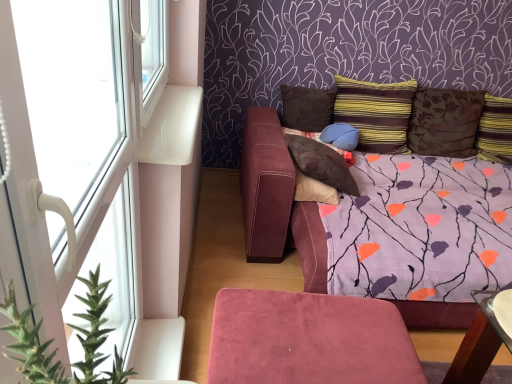
The height and width of the screenshot is (384, 512). In order to click on brown suede pillow at center, marked as the 1th pillow in a left-to-right arrangement in this screenshot , I will do `click(321, 163)`.

Locate an element on the screen. The width and height of the screenshot is (512, 384). brown suede pillow at upper center, the 2th pillow positioned from the left is located at coordinates (307, 107).

What do you see at coordinates (77, 172) in the screenshot? I see `white plastic window at left, acting as the 2th window starting from the top` at bounding box center [77, 172].

I want to click on brown suede pillow at center, which is the sixth pillow from right to left, so click(321, 163).

From the image's perspective, is white plastic window at left, which is the first window in bottom-to-top order, beneath striped fabric pillow at upper center, positioned as the fourth pillow in left-to-right order?

Indeed, from the image's perspective, white plastic window at left, which is the first window in bottom-to-top order, is shown beneath striped fabric pillow at upper center, positioned as the fourth pillow in left-to-right order.

Is white plastic window at left, which is the first window in bottom-to-top order, positioned with its back to striped fabric pillow at upper center, positioned as the fourth pillow in left-to-right order?

No, white plastic window at left, which is the first window in bottom-to-top order, is not facing the opposite direction of striped fabric pillow at upper center, positioned as the fourth pillow in left-to-right order.

Is the surface of white plastic window at left, which is the first window in bottom-to-top order, in direct contact with striped fabric pillow at upper center, placed as the 3th pillow when sorted from right to left?

No.

Does white plastic window at left, acting as the 2th window starting from the top, have a larger size compared to striped fabric pillow at upper center, positioned as the fourth pillow in left-to-right order?

Incorrect, white plastic window at left, acting as the 2th window starting from the top, is not larger than striped fabric pillow at upper center, positioned as the fourth pillow in left-to-right order.

Does brown textured pillow at upper right, arranged as the fifth pillow when viewed from the left, turn towards striped fabric pillow at upper right, marked as the 1th pillow in a right-to-left arrangement?

No, brown textured pillow at upper right, arranged as the fifth pillow when viewed from the left, is not aimed at striped fabric pillow at upper right, marked as the 1th pillow in a right-to-left arrangement.

Are brown textured pillow at upper right, which appears as the 2th pillow when viewed from the right, and striped fabric pillow at upper right, marked as the 1th pillow in a right-to-left arrangement, far apart?

No, brown textured pillow at upper right, which appears as the 2th pillow when viewed from the right, is in close proximity to striped fabric pillow at upper right, marked as the 1th pillow in a right-to-left arrangement.

Based on the photo, can you confirm if brown textured pillow at upper right, which appears as the 2th pillow when viewed from the right, is shorter than striped fabric pillow at upper right, marked as the 1th pillow in a right-to-left arrangement?

Incorrect, the height of brown textured pillow at upper right, which appears as the 2th pillow when viewed from the right, does not fall short of that of striped fabric pillow at upper right, marked as the 1th pillow in a right-to-left arrangement.

Does brown textured pillow at upper right, which appears as the 2th pillow when viewed from the right, appear on the right side of striped fabric pillow at upper right, marked as the 1th pillow in a right-to-left arrangement?

Incorrect, brown textured pillow at upper right, which appears as the 2th pillow when viewed from the right, is not on the right side of striped fabric pillow at upper right, marked as the 1th pillow in a right-to-left arrangement.

Are striped fabric pillow at upper center, placed as the 3th pillow when sorted from right to left, and white plastic window at upper left, placed as the first window when sorted from top to bottom, making contact?

No, striped fabric pillow at upper center, placed as the 3th pillow when sorted from right to left, is not beside white plastic window at upper left, placed as the first window when sorted from top to bottom.

Can you tell me how much striped fabric pillow at upper center, positioned as the fourth pillow in left-to-right order, and white plastic window at upper left, which is the 2th window from bottom to top, differ in facing direction?

The angular difference between striped fabric pillow at upper center, positioned as the fourth pillow in left-to-right order, and white plastic window at upper left, which is the 2th window from bottom to top, is 90.7 degrees.

Which object is closer to the camera, striped fabric pillow at upper center, positioned as the fourth pillow in left-to-right order, or white plastic window at upper left, which is the 2th window from bottom to top?

Positioned in front is white plastic window at upper left, which is the 2th window from bottom to top.

From a real-world perspective, which object stands above the other?

In real-world perspective, white plastic window at upper left, which is the 2th window from bottom to top, is above.

From a real-world perspective, is brown textured pillow at upper right, which appears as the 2th pillow when viewed from the right, physically located above or below striped fabric pillow at upper center, positioned as the fourth pillow in left-to-right order?

brown textured pillow at upper right, which appears as the 2th pillow when viewed from the right, is situated lower than striped fabric pillow at upper center, positioned as the fourth pillow in left-to-right order, in the real world.

Is brown textured pillow at upper right, arranged as the fifth pillow when viewed from the left, next to striped fabric pillow at upper center, placed as the 3th pillow when sorted from right to left?

No, brown textured pillow at upper right, arranged as the fifth pillow when viewed from the left, is not beside striped fabric pillow at upper center, placed as the 3th pillow when sorted from right to left.

Is brown textured pillow at upper right, arranged as the fifth pillow when viewed from the left, aimed at striped fabric pillow at upper center, placed as the 3th pillow when sorted from right to left?

No, brown textured pillow at upper right, arranged as the fifth pillow when viewed from the left, is not aimed at striped fabric pillow at upper center, placed as the 3th pillow when sorted from right to left.

From a real-world perspective, does white plastic window at upper left, which is the 2th window from bottom to top, sit lower than striped fabric pillow at upper right, marked as the 1th pillow in a right-to-left arrangement?

Incorrect, from a real-world perspective, white plastic window at upper left, which is the 2th window from bottom to top, is higher than striped fabric pillow at upper right, marked as the 1th pillow in a right-to-left arrangement.

In the image, is white plastic window at upper left, which is the 2th window from bottom to top, positioned in front of or behind striped fabric pillow at upper right, which ranks as the 6th pillow in left-to-right order?

In the image, white plastic window at upper left, which is the 2th window from bottom to top, appears in front of striped fabric pillow at upper right, which ranks as the 6th pillow in left-to-right order.

Can we say white plastic window at upper left, which is the 2th window from bottom to top, lies outside striped fabric pillow at upper right, marked as the 1th pillow in a right-to-left arrangement?

Yes, white plastic window at upper left, which is the 2th window from bottom to top, is not within striped fabric pillow at upper right, marked as the 1th pillow in a right-to-left arrangement.

Consider the image. Can you confirm if green spiky plant at left is smaller than striped fabric pillow at upper right, marked as the 1th pillow in a right-to-left arrangement?

Yes, green spiky plant at left is smaller than striped fabric pillow at upper right, marked as the 1th pillow in a right-to-left arrangement.

Consider the image. Can you confirm if green spiky plant at left is wider than striped fabric pillow at upper right, marked as the 1th pillow in a right-to-left arrangement?

In fact, green spiky plant at left might be narrower than striped fabric pillow at upper right, marked as the 1th pillow in a right-to-left arrangement.

Can you tell me how much green spiky plant at left and striped fabric pillow at upper right, which ranks as the 6th pillow in left-to-right order, differ in facing direction?

The angular difference between green spiky plant at left and striped fabric pillow at upper right, which ranks as the 6th pillow in left-to-right order, is 90.1 degrees.

From a real-world perspective, between green spiky plant at left and striped fabric pillow at upper right, which ranks as the 6th pillow in left-to-right order, who is vertically lower?

In real-world perspective, striped fabric pillow at upper right, which ranks as the 6th pillow in left-to-right order, is lower.

Is matte blue pillow at center, which is counted as the fourth pillow, starting from the right, placed right next to brown textured pillow at upper right, arranged as the fifth pillow when viewed from the left?

No, matte blue pillow at center, which is counted as the fourth pillow, starting from the right, is not in contact with brown textured pillow at upper right, arranged as the fifth pillow when viewed from the left.

From the image's perspective, is matte blue pillow at center, which is counted as the fourth pillow, starting from the right, under brown textured pillow at upper right, which appears as the 2th pillow when viewed from the right?

Correct, matte blue pillow at center, which is counted as the fourth pillow, starting from the right, appears lower than brown textured pillow at upper right, which appears as the 2th pillow when viewed from the right, in the image.

Considering the relative positions of matte blue pillow at center, the 3th pillow viewed from the left, and brown textured pillow at upper right, which appears as the 2th pillow when viewed from the right, in the image provided, is matte blue pillow at center, the 3th pillow viewed from the left, behind brown textured pillow at upper right, which appears as the 2th pillow when viewed from the right,?

No, matte blue pillow at center, the 3th pillow viewed from the left, is closer to the viewer.

Find the location of a particular element. The height and width of the screenshot is (384, 512). pillow that is the 2nd object located behind the white plastic window at left, acting as the 2th window starting from the top is located at coordinates (376, 113).

There is a striped fabric pillow at upper right, which ranks as the 6th pillow in left-to-right order. Where is `the 1st pillow above it (from the image's perspective)`? This screenshot has width=512, height=384. the 1st pillow above it (from the image's perspective) is located at coordinates (444, 122).

Which object lies nearer to the anchor point brown suede pillow at upper center, the 2th pillow positioned from the left, matte blue pillow at center, which is counted as the fourth pillow, starting from the right, or striped fabric pillow at upper right, marked as the 1th pillow in a right-to-left arrangement?

matte blue pillow at center, which is counted as the fourth pillow, starting from the right, lies closer to brown suede pillow at upper center, the 2th pillow positioned from the left, than the other object.

Based on their spatial positions, is striped fabric pillow at upper right, which ranks as the 6th pillow in left-to-right order, or striped fabric pillow at upper center, placed as the 3th pillow when sorted from right to left, closer to brown suede pillow at center, marked as the 1th pillow in a left-to-right arrangement?

Based on the image, striped fabric pillow at upper center, placed as the 3th pillow when sorted from right to left, appears to be nearer to brown suede pillow at center, marked as the 1th pillow in a left-to-right arrangement.

From the picture: Looking at the image, which one is located further to white plastic window at upper left, which is the 2th window from bottom to top, brown suede pillow at upper center, the 2th pillow positioned from the left, or green spiky plant at left?

green spiky plant at left is further to white plastic window at upper left, which is the 2th window from bottom to top.

Based on their spatial positions, is white plastic window at left, which is the first window in bottom-to-top order, or matte blue pillow at center, which is counted as the fourth pillow, starting from the right, further from suede ottoman at lower center?

matte blue pillow at center, which is counted as the fourth pillow, starting from the right, lies further to suede ottoman at lower center than the other object.

In the scene shown: Based on their spatial positions, is striped fabric pillow at upper right, which ranks as the 6th pillow in left-to-right order, or striped fabric pillow at upper center, placed as the 3th pillow when sorted from right to left, further from white plastic window at left, which is the first window in bottom-to-top order?

striped fabric pillow at upper right, which ranks as the 6th pillow in left-to-right order, is further to white plastic window at left, which is the first window in bottom-to-top order.

Considering their positions, is striped fabric pillow at upper right, which ranks as the 6th pillow in left-to-right order, positioned closer to white plastic window at upper left, which is the 2th window from bottom to top, than white plastic window at left, which is the first window in bottom-to-top order?

white plastic window at left, which is the first window in bottom-to-top order.

Looking at the image, which one is located closer to white plastic window at left, acting as the 2th window starting from the top, brown suede pillow at center, marked as the 1th pillow in a left-to-right arrangement, or matte blue pillow at center, which is counted as the fourth pillow, starting from the right?

brown suede pillow at center, marked as the 1th pillow in a left-to-right arrangement.

When comparing their distances from suede ottoman at lower center, does white plastic window at left, acting as the 2th window starting from the top, or brown suede pillow at center, which is the sixth pillow from right to left, seem closer?

Based on the image, white plastic window at left, acting as the 2th window starting from the top, appears to be nearer to suede ottoman at lower center.

Find the location of a particular element. The image size is (512, 384). window between white plastic window at left, which is the first window in bottom-to-top order, and striped fabric pillow at upper center, placed as the 3th pillow when sorted from right to left, in the front-back direction is located at coordinates (151, 52).

The image size is (512, 384). I want to click on furniture between white plastic window at left, acting as the 2th window starting from the top, and matte blue pillow at center, the 3th pillow viewed from the left, along the z-axis, so click(308, 340).

The width and height of the screenshot is (512, 384). In order to click on pillow positioned between brown suede pillow at center, which is the sixth pillow from right to left, and matte blue pillow at center, which is counted as the fourth pillow, starting from the right, from near to far in this screenshot , I will do `click(376, 113)`.

Image resolution: width=512 pixels, height=384 pixels. I want to click on furniture located between green spiky plant at left and striped fabric pillow at upper center, positioned as the fourth pillow in left-to-right order, in the depth direction, so click(x=308, y=340).